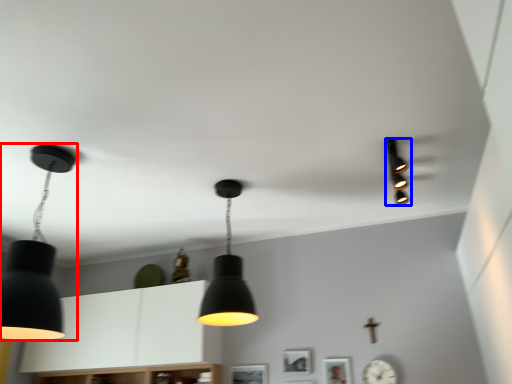
Question: Which of the following is the farthest to the observer, lamp (highlighted by a red box) or lamp (highlighted by a blue box)?

Choices:
 (A) lamp
 (B) lamp

Answer: (B)